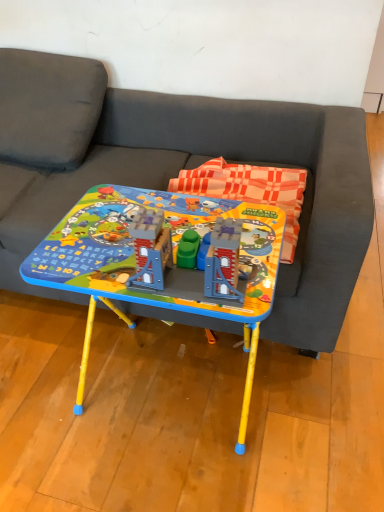
This screenshot has height=512, width=384. Find the location of `free point above matte plastic table at center (from a real-world perspective)`. free point above matte plastic table at center (from a real-world perspective) is located at coordinates (132, 234).